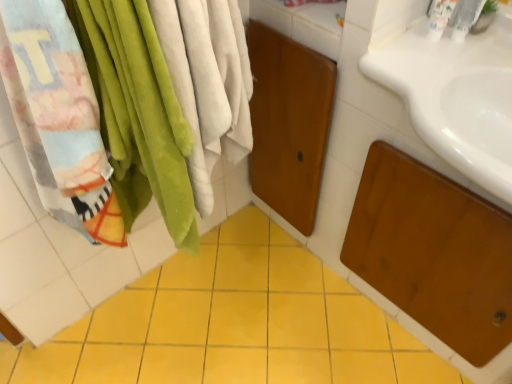
Question: From the image's perspective, would you say white plastic faucet at upper right, the first toiletry positioned from the right, is shown under white plastic bottle at upper right, positioned as the second toiletry in right-to-left order?

Choices:
 (A) no
 (B) yes

Answer: (B)

Question: Is white plastic faucet at upper right, the first toiletry positioned from the right, further to camera compared to white plastic bottle at upper right, positioned as the second toiletry in right-to-left order?

Choices:
 (A) no
 (B) yes

Answer: (A)

Question: Is the surface of white plastic faucet at upper right, placed as the 2th toiletry when sorted from left to right, in direct contact with white plastic bottle at upper right, positioned as the second toiletry in right-to-left order?

Choices:
 (A) no
 (B) yes

Answer: (B)

Question: From a real-world perspective, is white plastic faucet at upper right, placed as the 2th toiletry when sorted from left to right, physically above white plastic bottle at upper right, positioned as the second toiletry in right-to-left order?

Choices:
 (A) yes
 (B) no

Answer: (A)

Question: Is there a large distance between white plastic faucet at upper right, placed as the 2th toiletry when sorted from left to right, and white plastic bottle at upper right, positioned as the second toiletry in right-to-left order?

Choices:
 (A) no
 (B) yes

Answer: (A)

Question: Considering the positions of yellow ceramic tile at center and white plastic faucet at upper right, the first toiletry positioned from the right, in the image, is yellow ceramic tile at center wider or thinner than white plastic faucet at upper right, the first toiletry positioned from the right,?

Choices:
 (A) wide
 (B) thin

Answer: (A)

Question: Is yellow ceramic tile at center in front of or behind white plastic faucet at upper right, placed as the 2th toiletry when sorted from left to right, in the image?

Choices:
 (A) front
 (B) behind

Answer: (A)

Question: From the image's perspective, is yellow ceramic tile at center located above or below white plastic faucet at upper right, placed as the 2th toiletry when sorted from left to right?

Choices:
 (A) above
 (B) below

Answer: (B)

Question: In terms of height, does yellow ceramic tile at center look taller or shorter compared to white plastic faucet at upper right, the first toiletry positioned from the right?

Choices:
 (A) short
 (B) tall

Answer: (A)

Question: In terms of height, does white plastic bottle at upper right, the first toiletry when ordered from left to right, look taller or shorter compared to white plastic faucet at upper right, the first toiletry positioned from the right?

Choices:
 (A) short
 (B) tall

Answer: (A)

Question: From the image's perspective, is white plastic bottle at upper right, positioned as the second toiletry in right-to-left order, positioned above or below white plastic faucet at upper right, placed as the 2th toiletry when sorted from left to right?

Choices:
 (A) below
 (B) above

Answer: (B)

Question: Considering the positions of white plastic bottle at upper right, the first toiletry when ordered from left to right, and white plastic faucet at upper right, placed as the 2th toiletry when sorted from left to right, in the image, is white plastic bottle at upper right, the first toiletry when ordered from left to right, wider or thinner than white plastic faucet at upper right, placed as the 2th toiletry when sorted from left to right,?

Choices:
 (A) wide
 (B) thin

Answer: (A)

Question: Is point (438, 8) positioned closer to the camera than point (467, 1)?

Choices:
 (A) farther
 (B) closer

Answer: (A)

Question: From the image's perspective, is white plastic faucet at upper right, the first toiletry positioned from the right, positioned above or below white plastic bottle at upper right, positioned as the second toiletry in right-to-left order?

Choices:
 (A) below
 (B) above

Answer: (A)

Question: Is white plastic faucet at upper right, the first toiletry positioned from the right, inside the boundaries of white plastic bottle at upper right, the first toiletry when ordered from left to right, or outside?

Choices:
 (A) outside
 (B) inside

Answer: (A)